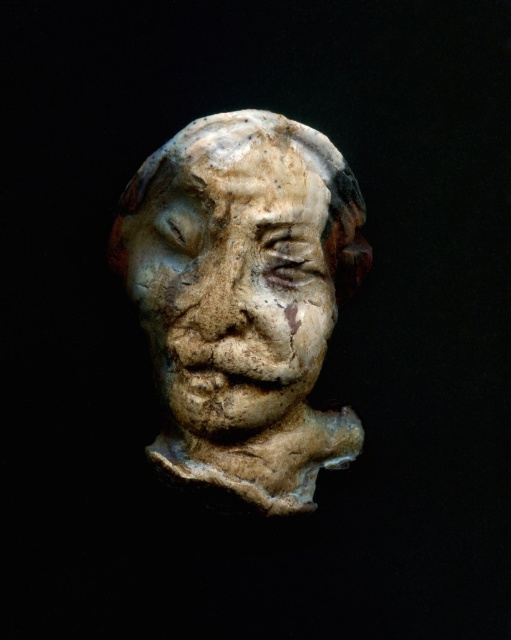
You are a GUI agent. You are given a task and a screenshot of the screen. Output one action in this format:
    pyautogui.click(x=<x>, y=<y>)
    Task: Click on the white clay head at center
    
    Given the screenshot: What is the action you would take?
    pyautogui.click(x=243, y=300)

Does point (123, 193) lie in front of point (297, 168)?

No, (123, 193) is further to viewer.

Find the location of a particular element. Image resolution: width=511 pixels, height=640 pixels. white clay head at center is located at coordinates (243, 300).